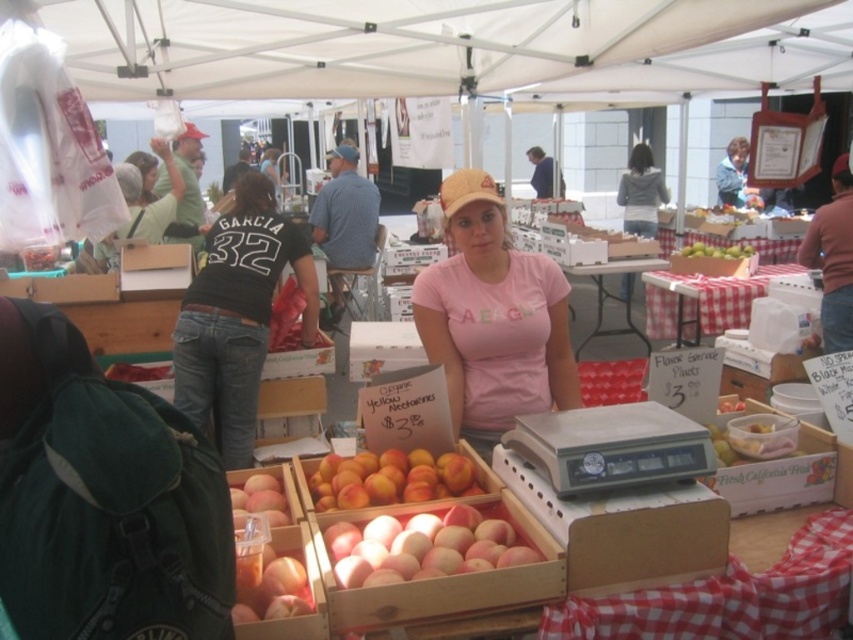
Question: Which of the following is the farthest from the observer?

Choices:
 (A) green matte apples at center
 (B) gray fleece jacket at upper center
 (C) black cotton shirt at center

Answer: (B)

Question: Is black cotton shirt at center below blue denim jacket at upper center?

Choices:
 (A) no
 (B) yes

Answer: (B)

Question: Does red checkered tablecloth at center come in front of checkered fabric table at center?

Choices:
 (A) no
 (B) yes

Answer: (B)

Question: Which of the following is the farthest from the observer?

Choices:
 (A) ripe yellow peaches at center
 (B) black cotton shirt at center
 (C) blue denim jacket at upper center
 (D) gray fleece jacket at upper center

Answer: (C)

Question: Which point appears closest to the camera in this image?

Choices:
 (A) (257, 349)
 (B) (647, 145)
 (C) (601, 628)
 (D) (743, 301)

Answer: (C)

Question: Does checkered fabric table at center appear on the left side of blue denim jacket at upper center?

Choices:
 (A) yes
 (B) no

Answer: (B)